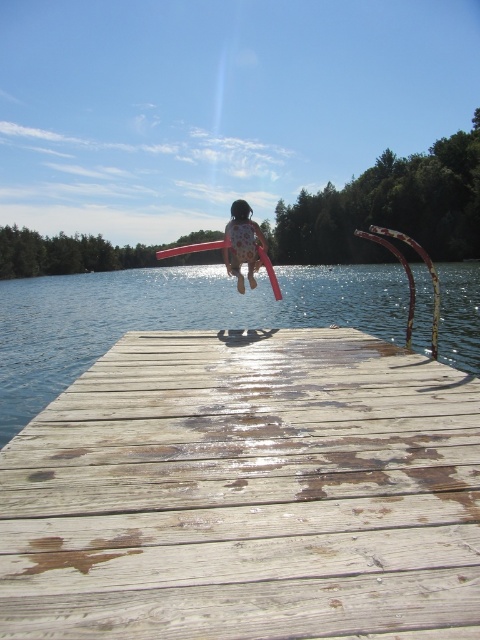
You are standing on the weathered wood dock at center and want to jump into the clear water at center. Based on the scene description, will your jump land you safely in the water?

Yes, because the weathered wood dock at center is closer to the viewer than clear water at center, meaning the water is further away and you can safely jump into it.

You are standing on the dock and want to jump into the lake. There are two points marked on the dock at coordinates point (99, 548) and point (107, 275). Which point is closer to the edge of the dock so you can jump safely?

Point (99, 548) is in front of point (107, 275), so it is closer to the edge of the dock. Therefore, jumping from point (99, 548) would be safer.